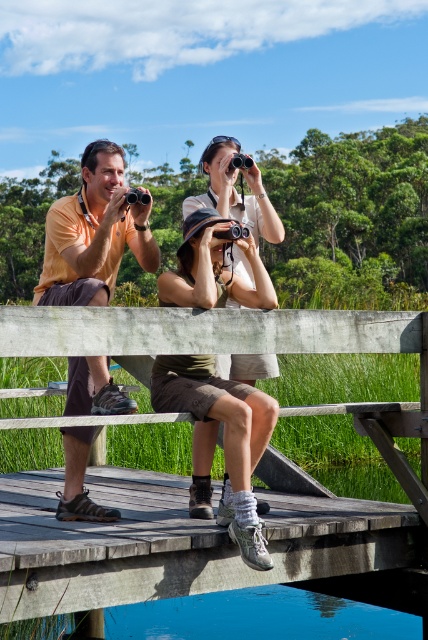
Is point (83, 444) farther from camera compared to point (70, 433)?

That is True.

Can you confirm if matte orange shirt at center is positioned above matte yellow shirt at left?

Actually, matte orange shirt at center is below matte yellow shirt at left.

What do you see at coordinates (94, 234) in the screenshot? I see `matte orange shirt at center` at bounding box center [94, 234].

Identify the location of matte orange shirt at center. This screenshot has width=428, height=640. (94, 234).

Who is more forward, (68,440) or (136,189)?

Point (68,440) is more forward.

Does matte orange shirt at center appear on the right side of black plastic camera at upper left?

Correct, you'll find matte orange shirt at center to the right of black plastic camera at upper left.

In order to click on matte orange shirt at center in this screenshot , I will do tap(94, 234).

Is wooden bench at center closer to the viewer compared to matte orange shirt at center?

Yes, wooden bench at center is in front of matte orange shirt at center.

Is wooden bench at center bigger than matte orange shirt at center?

Indeed, wooden bench at center has a larger size compared to matte orange shirt at center.

Does point (412, 426) come in front of point (240, 500)?

That is False.

You are a GUI agent. You are given a task and a screenshot of the screen. Output one action in this format:
    pyautogui.click(x=<x>, y=<y>)
    Task: Click on the wooden bench at center
    This screenshot has width=428, height=640.
    Given the screenshot: What is the action you would take?
    pyautogui.click(x=178, y=544)